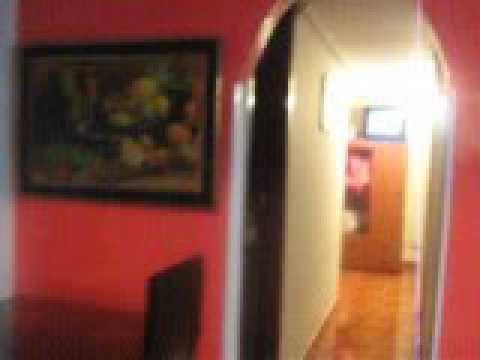
I want to click on painting of perhaps fruit, so click(x=167, y=130), click(x=145, y=130), click(x=57, y=94), click(x=126, y=160).